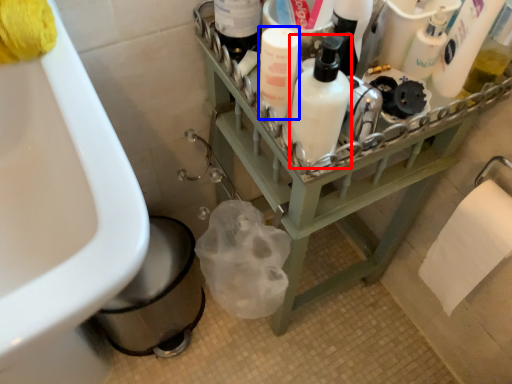
Question: Which of the following is the closest to the observer, cleaning product (highlighted by a red box) or cleaning product (highlighted by a blue box)?

Choices:
 (A) cleaning product
 (B) cleaning product

Answer: (A)